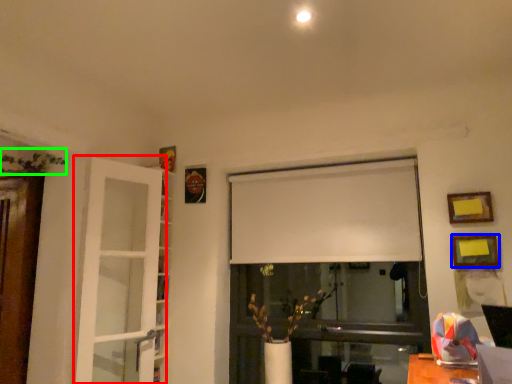
Question: Based on their relative distances, which object is nearer to door (highlighted by a red box)? Choose from picture frame (highlighted by a blue box) and plant (highlighted by a green box).

Choices:
 (A) picture frame
 (B) plant

Answer: (B)